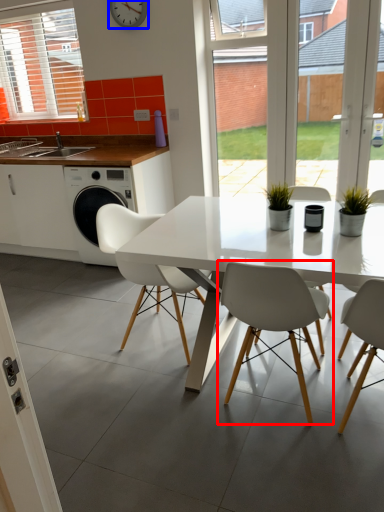
Question: Which object appears closest to the camera in this image, chair (highlighted by a red box) or clock (highlighted by a blue box)?

Choices:
 (A) chair
 (B) clock

Answer: (A)